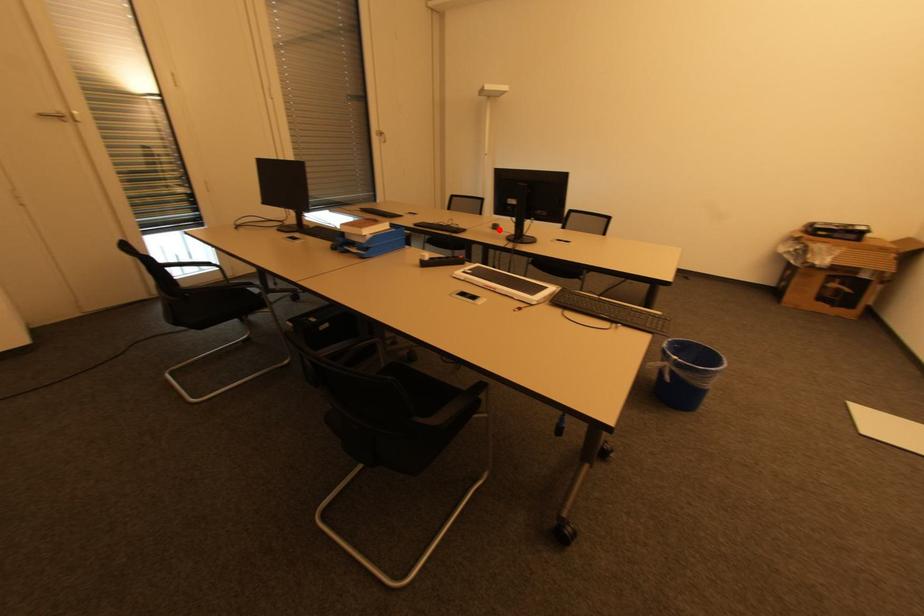
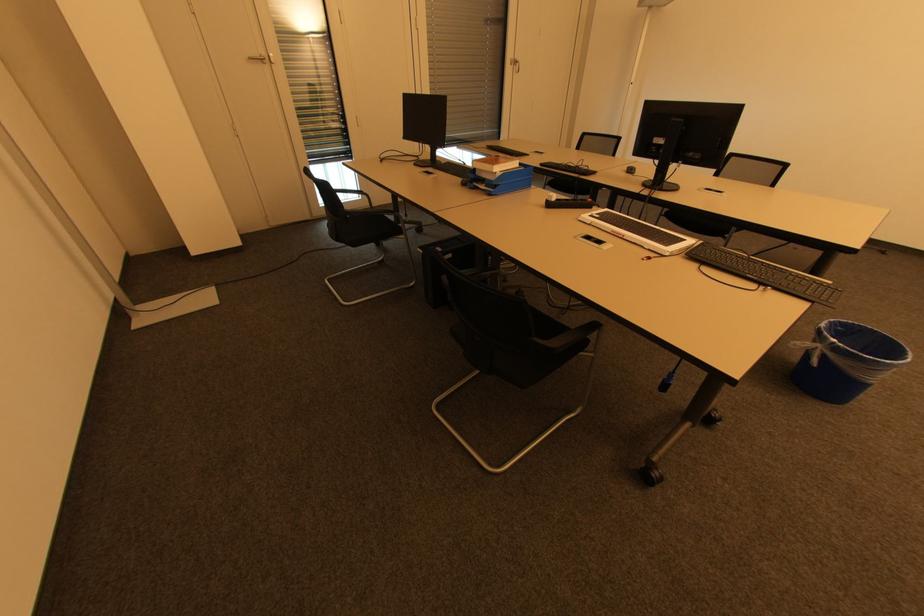
Locate, in the second image, the point that corresponds to the highlighted location in the first image.

(634, 174)